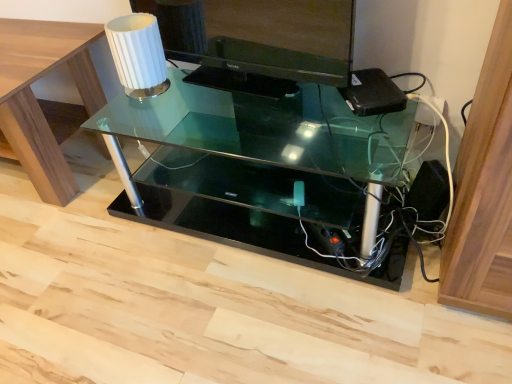
Question: Is black glossy monitor at upper center bigger than clear glass table at upper left, positioned as the second table in right-to-left order?

Choices:
 (A) no
 (B) yes

Answer: (A)

Question: Is black glossy monitor at upper center turned away from clear glass table at upper left, the first table from the left?

Choices:
 (A) yes
 (B) no

Answer: (B)

Question: Does black glossy monitor at upper center have a lesser height compared to clear glass table at upper left, the first table from the left?

Choices:
 (A) no
 (B) yes

Answer: (B)

Question: Is black glossy monitor at upper center positioned before clear glass table at upper left, the first table from the left?

Choices:
 (A) yes
 (B) no

Answer: (A)

Question: Would you say black glossy monitor at upper center contains clear glass table at upper left, the first table from the left?

Choices:
 (A) yes
 (B) no

Answer: (B)

Question: Considering the relative sizes of black glossy monitor at upper center and clear glass table at upper left, positioned as the second table in right-to-left order, in the image provided, is black glossy monitor at upper center smaller than clear glass table at upper left, positioned as the second table in right-to-left order,?

Choices:
 (A) yes
 (B) no

Answer: (A)

Question: From the image's perspective, is transparent glass table at center, which is counted as the 2th table, starting from the left, located above black glossy monitor at upper center?

Choices:
 (A) no
 (B) yes

Answer: (A)

Question: Is transparent glass table at center, which appears as the 1th table when viewed from the right, outside black glossy monitor at upper center?

Choices:
 (A) yes
 (B) no

Answer: (A)

Question: Is transparent glass table at center, which appears as the 1th table when viewed from the right, looking in the opposite direction of black glossy monitor at upper center?

Choices:
 (A) yes
 (B) no

Answer: (B)

Question: Would you consider transparent glass table at center, which appears as the 1th table when viewed from the right, to be distant from black glossy monitor at upper center?

Choices:
 (A) yes
 (B) no

Answer: (B)

Question: Can you confirm if transparent glass table at center, which appears as the 1th table when viewed from the right, is wider than black glossy monitor at upper center?

Choices:
 (A) yes
 (B) no

Answer: (A)

Question: From a real-world perspective, is transparent glass table at center, which appears as the 1th table when viewed from the right, under black glossy monitor at upper center?

Choices:
 (A) yes
 (B) no

Answer: (A)

Question: Considering the relative sizes of black glossy monitor at upper center and transparent glass table at center, which is counted as the 2th table, starting from the left, in the image provided, is black glossy monitor at upper center shorter than transparent glass table at center, which is counted as the 2th table, starting from the left,?

Choices:
 (A) no
 (B) yes

Answer: (B)